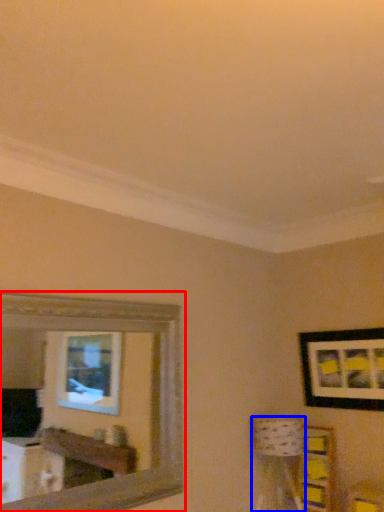
Question: Which object is further to the camera taking this photo, mirror (highlighted by a red box) or table lamp (highlighted by a blue box)?

Choices:
 (A) mirror
 (B) table lamp

Answer: (B)